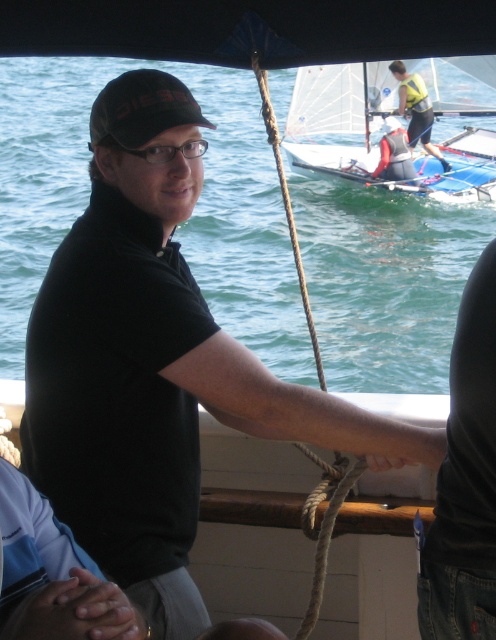
You are a photographer on the boat. You want to take a photo of the white sailboat at upper center and the clear plastic glasses at center. Which object will appear larger in the photo?

The white sailboat at upper center will appear larger in the photo because it is much taller than the clear plastic glasses at center.

You are a safety inspector checking the boat for proper equipment. You notice the brown leather hand at lower left and the yellow life vest at upper right. Which object is larger in size?

The yellow life vest at upper right is larger than the brown leather hand at lower left.